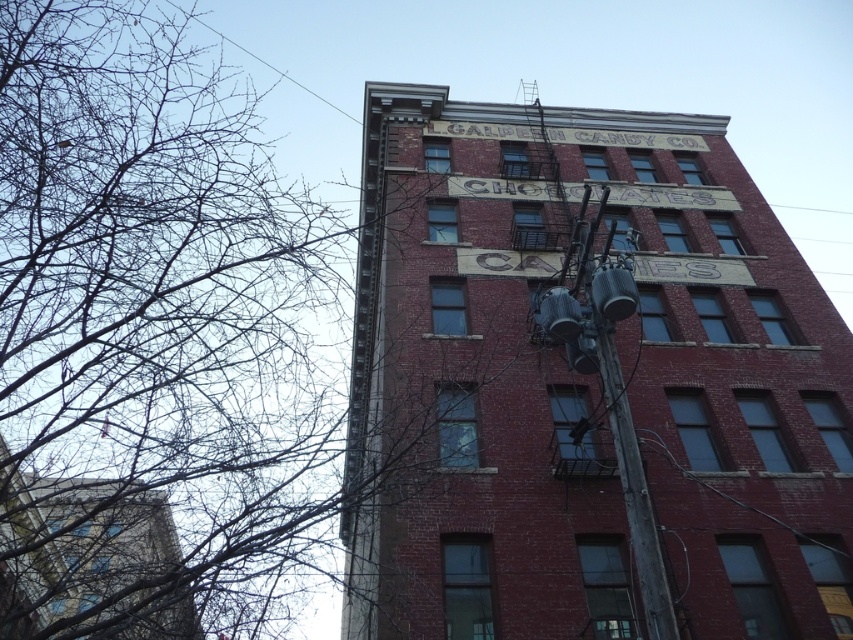
Question: Can you confirm if red brick building at upper center is thinner than bare branches at upper left?

Choices:
 (A) no
 (B) yes

Answer: (B)

Question: Which point is closer to the camera?

Choices:
 (A) bare branches at upper left
 (B) red brick building at upper center

Answer: (B)

Question: Which point appears farthest from the camera in this image?

Choices:
 (A) (322, 474)
 (B) (814, 364)

Answer: (A)

Question: Is red brick building at upper center smaller than bare branches at upper left?

Choices:
 (A) no
 (B) yes

Answer: (B)

Question: Is red brick building at upper center above bare branches at upper left?

Choices:
 (A) no
 (B) yes

Answer: (A)